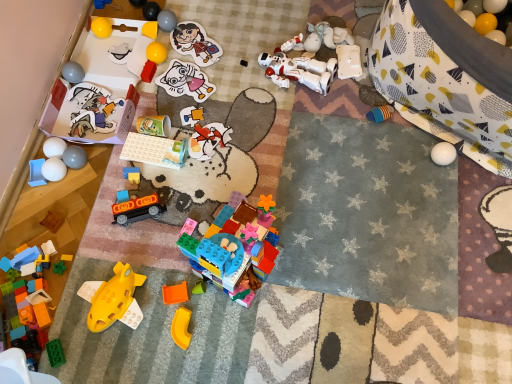
I want to click on vacant area that lies between matte blue plastic toy at center, marked as the thirteenth toy in a right-to-left arrangement, and white plastic remote control at upper center, the 24th toy when ordered from left to right, so tap(243, 125).